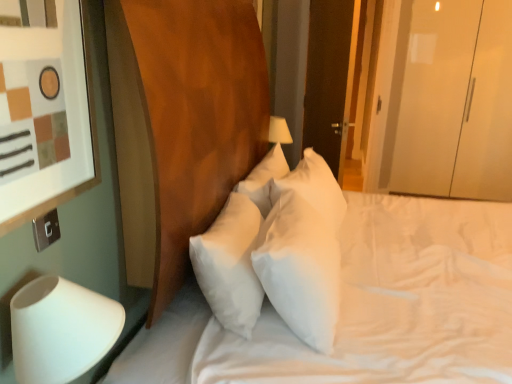
Question: Is silver metallic switch at lower left completely or partially inside white soft pillow at center?

Choices:
 (A) no
 (B) yes

Answer: (A)

Question: Is white soft pillow at center oriented away from silver metallic switch at lower left?

Choices:
 (A) yes
 (B) no

Answer: (B)

Question: Is white soft pillow at center at the right side of silver metallic switch at lower left?

Choices:
 (A) yes
 (B) no

Answer: (A)

Question: From the image's perspective, is white soft pillow at center under silver metallic switch at lower left?

Choices:
 (A) no
 (B) yes

Answer: (B)

Question: Would you say white soft pillow at center is a long distance from silver metallic switch at lower left?

Choices:
 (A) yes
 (B) no

Answer: (A)

Question: In the image, is white soft pillow at center positioned in front of or behind white soft mattress at center?

Choices:
 (A) front
 (B) behind

Answer: (B)

Question: In the image, is white soft pillow at center on the left side or the right side of white soft mattress at center?

Choices:
 (A) right
 (B) left

Answer: (B)

Question: Is white soft pillow at center bigger or smaller than white soft mattress at center?

Choices:
 (A) big
 (B) small

Answer: (B)

Question: From the image's perspective, relative to white soft mattress at center, is white soft pillow at center above or below?

Choices:
 (A) below
 (B) above

Answer: (B)

Question: Is dark wood door at upper right to the left or to the right of white soft mattress at center in the image?

Choices:
 (A) right
 (B) left

Answer: (B)

Question: From the image's perspective, relative to white soft mattress at center, is dark wood door at upper right above or below?

Choices:
 (A) above
 (B) below

Answer: (A)

Question: Is dark wood door at upper right bigger or smaller than white soft mattress at center?

Choices:
 (A) big
 (B) small

Answer: (B)

Question: In the image, is dark wood door at upper right positioned in front of or behind white soft mattress at center?

Choices:
 (A) front
 (B) behind

Answer: (B)

Question: Is transparent glossy wardrobe at right wider or thinner than white soft pillow at center?

Choices:
 (A) wide
 (B) thin

Answer: (A)

Question: Is point (425, 61) positioned closer to the camera than point (266, 266)?

Choices:
 (A) farther
 (B) closer

Answer: (A)